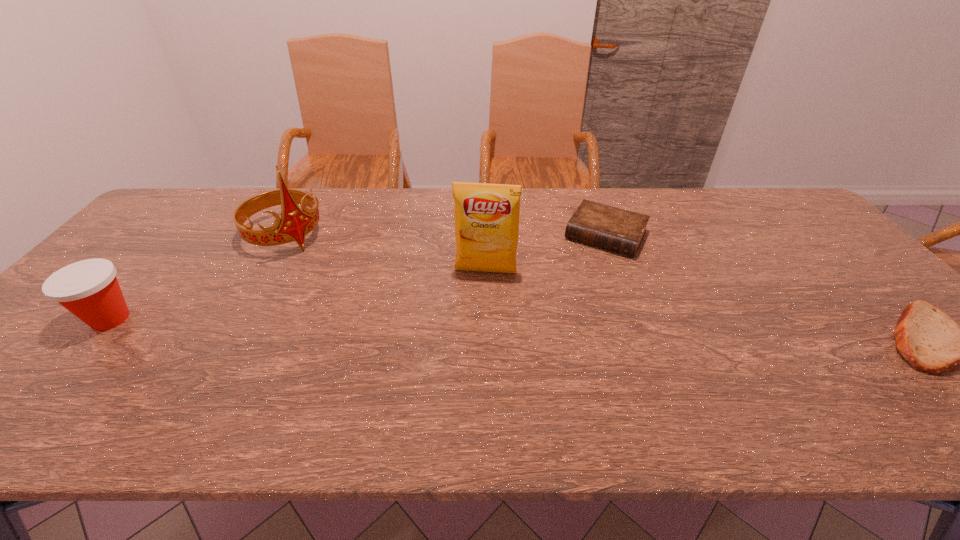
The height and width of the screenshot is (540, 960). Find the location of `free space on the desktop that is between the Dixie cup and the pita bread and is positioned on the spine side of the second shortest object`. free space on the desktop that is between the Dixie cup and the pita bread and is positioned on the spine side of the second shortest object is located at coordinates (553, 329).

Where is `vacant space on the desktop that is between the third tallest object and the pita bread and is positioned on the front of the third farthest object with the logo`? This screenshot has width=960, height=540. vacant space on the desktop that is between the third tallest object and the pita bread and is positioned on the front of the third farthest object with the logo is located at coordinates (478, 327).

Where is `vacant space on the desktop that is between the third tallest object and the rightmost object and is positioned on the front-facing side of the tiara`? This screenshot has height=540, width=960. vacant space on the desktop that is between the third tallest object and the rightmost object and is positioned on the front-facing side of the tiara is located at coordinates (391, 326).